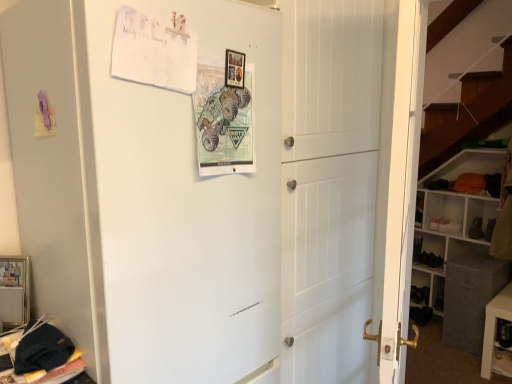
Where is `black fabric cabinet at lower right`? This screenshot has height=384, width=512. black fabric cabinet at lower right is located at coordinates (420, 288).

Measure the distance between white matte refrigerator at upper left and camera.

white matte refrigerator at upper left and camera are 85.77 centimeters apart.

Find the location of a particular element. Image resolution: width=512 pixels, height=384 pixels. black leather shoe at right, which is counted as the second shoe, starting from the right is located at coordinates (417, 248).

Image resolution: width=512 pixels, height=384 pixels. Describe the element at coordinates (417, 248) in the screenshot. I see `black leather shoe at right, which is counted as the second shoe, starting from the right` at that location.

The height and width of the screenshot is (384, 512). Find the location of `white wooden bookshelf at right`. white wooden bookshelf at right is located at coordinates (462, 248).

Considering the relative sizes of black fabric cabinet at lower right and white matte refrigerator at upper left in the image provided, is black fabric cabinet at lower right taller than white matte refrigerator at upper left?

No, black fabric cabinet at lower right is not taller than white matte refrigerator at upper left.

Between black fabric cabinet at lower right and white matte refrigerator at upper left, which one has larger size?

white matte refrigerator at upper left is bigger.

Is white matte refrigerator at upper left a part of black fabric cabinet at lower right?

Definitely not — white matte refrigerator at upper left is not inside black fabric cabinet at lower right.

From a real-world perspective, is black fabric cabinet at lower right beneath white matte refrigerator at upper left?

Yes, from a real-world perspective, black fabric cabinet at lower right is beneath white matte refrigerator at upper left.

Is white wooden bookshelf at right completely or partially inside black leather shoe at lower right, placed as the second shoe when sorted from left to right?

No, white wooden bookshelf at right is located outside of black leather shoe at lower right, placed as the second shoe when sorted from left to right.

Considering the sizes of black leather shoe at lower right, which ranks as the first shoe in right-to-left order, and white wooden bookshelf at right in the image, is black leather shoe at lower right, which ranks as the first shoe in right-to-left order, taller or shorter than white wooden bookshelf at right?

In the image, black leather shoe at lower right, which ranks as the first shoe in right-to-left order, appears to be shorter than white wooden bookshelf at right.

From a real-world perspective, which object stands above the other?

white wooden bookshelf at right, from a real-world perspective.

Is black leather shoe at lower right, placed as the second shoe when sorted from left to right, aimed at white wooden bookshelf at right?

Yes, black leather shoe at lower right, placed as the second shoe when sorted from left to right, is oriented towards white wooden bookshelf at right.

Would you say white wooden bookshelf at right is a long distance from black fabric cabinet at lower right?

That's not correct — white wooden bookshelf at right is a little close to black fabric cabinet at lower right.

Considering the sizes of objects white wooden bookshelf at right and black fabric cabinet at lower right in the image provided, who is smaller, white wooden bookshelf at right or black fabric cabinet at lower right?

With smaller size is black fabric cabinet at lower right.

Relative to black fabric cabinet at lower right, is white wooden bookshelf at right in front or behind?

Clearly, white wooden bookshelf at right is in front of black fabric cabinet at lower right.

From a real-world perspective, is white wooden bookshelf at right located beneath black fabric cabinet at lower right?

No, from a real-world perspective, white wooden bookshelf at right is not below black fabric cabinet at lower right.

Considering the sizes of objects white wooden bookshelf at right and white matte refrigerator at upper left in the image provided, who is shorter, white wooden bookshelf at right or white matte refrigerator at upper left?

white wooden bookshelf at right.

How distant is white wooden bookshelf at right from white matte refrigerator at upper left?

They are 7.39 feet apart.

Is white wooden bookshelf at right far away from white matte refrigerator at upper left?

Absolutely, white wooden bookshelf at right is distant from white matte refrigerator at upper left.

From the image's perspective, does white wooden bookshelf at right appear higher than white matte refrigerator at upper left?

No.

Is point (119, 73) positioned before point (432, 262)?

Yes, point (119, 73) is in front of point (432, 262).

Find the location of `the 2nd shoe below the white paper postcard at upper left, which is the second postcard in right-to-left order (from the image's perspective)`. the 2nd shoe below the white paper postcard at upper left, which is the second postcard in right-to-left order (from the image's perspective) is located at coordinates (430, 260).

From a real-world perspective, is white paper postcard at upper left, which is the second postcard in right-to-left order, physically located above or below black leather shoe at lower right, placed as the second shoe when sorted from left to right?

white paper postcard at upper left, which is the second postcard in right-to-left order, is situated higher than black leather shoe at lower right, placed as the second shoe when sorted from left to right, in the real world.

Based on the photo, considering the relative sizes of white paper postcard at upper left, which appears as the 1th postcard when viewed from the left, and black leather shoe at lower right, which ranks as the first shoe in right-to-left order, in the image provided, is white paper postcard at upper left, which appears as the 1th postcard when viewed from the left, wider than black leather shoe at lower right, which ranks as the first shoe in right-to-left order,?

Incorrect, the width of white paper postcard at upper left, which appears as the 1th postcard when viewed from the left, does not surpass that of black leather shoe at lower right, which ranks as the first shoe in right-to-left order.

How many degrees apart are the facing directions of white paper postcard at upper left, which is the second postcard in right-to-left order, and black fabric cabinet at lower right?

The angle between the facing direction of white paper postcard at upper left, which is the second postcard in right-to-left order, and the facing direction of black fabric cabinet at lower right is 91.5 degrees.

From the image's perspective, is white paper postcard at upper left, which is the second postcard in right-to-left order, located above black fabric cabinet at lower right?

Correct, white paper postcard at upper left, which is the second postcard in right-to-left order, appears higher than black fabric cabinet at lower right in the image.

Which object is wider, white paper postcard at upper left, which appears as the 1th postcard when viewed from the left, or black fabric cabinet at lower right?

black fabric cabinet at lower right.

The height and width of the screenshot is (384, 512). Find the location of `postcard that is the 2nd object located above the black fabric cabinet at lower right (from the image's perspective)`. postcard that is the 2nd object located above the black fabric cabinet at lower right (from the image's perspective) is located at coordinates click(x=154, y=51).

Looking at this image, is black leather shoe at lower right, placed as the second shoe when sorted from left to right, directly adjacent to black fabric cabinet at lower right?

black leather shoe at lower right, placed as the second shoe when sorted from left to right, and black fabric cabinet at lower right are clearly separated.

Could you measure the distance between black leather shoe at lower right, which ranks as the first shoe in right-to-left order, and black fabric cabinet at lower right?

black leather shoe at lower right, which ranks as the first shoe in right-to-left order, is 7.61 inches away from black fabric cabinet at lower right.

Is black fabric cabinet at lower right inside black leather shoe at lower right, placed as the second shoe when sorted from left to right?

No, black fabric cabinet at lower right is not inside black leather shoe at lower right, placed as the second shoe when sorted from left to right.

Between black leather shoe at lower right, which ranks as the first shoe in right-to-left order, and black fabric cabinet at lower right, which one appears on the left side from the viewer's perspective?

Positioned to the left is black fabric cabinet at lower right.

Locate an element on the screen. This screenshot has height=384, width=512. door located above the black fabric cabinet at lower right (from the image's perspective) is located at coordinates (182, 210).

Locate an element on the screen. The image size is (512, 384). bookshelf that is above the black leather shoe at lower right, placed as the second shoe when sorted from left to right (from a real-world perspective) is located at coordinates (462, 248).

Based on their spatial positions, is white wooden bookshelf at right or white paper postcard at upper left, which is the second postcard in right-to-left order, closer to black leather shoe at lower right, which ranks as the first shoe in right-to-left order?

white wooden bookshelf at right lies closer to black leather shoe at lower right, which ranks as the first shoe in right-to-left order, than the other object.

Looking at the image, which one is located closer to black fabric cabinet at lower right, white paper postcard at upper left, which is the second postcard in right-to-left order, or black leather shoe at lower right, which ranks as the first shoe in right-to-left order?

black leather shoe at lower right, which ranks as the first shoe in right-to-left order, lies closer to black fabric cabinet at lower right than the other object.

From the image, which object appears to be nearer to black leather shoe at lower right, placed as the second shoe when sorted from left to right, black leather shoe at right, the 1th shoe from the left, or matte paper postcard at center, placed as the 2th postcard when sorted from left to right?

black leather shoe at right, the 1th shoe from the left, lies closer to black leather shoe at lower right, placed as the second shoe when sorted from left to right, than the other object.

Which object lies further to the anchor point white paper postcard at upper left, which is the second postcard in right-to-left order, white wooden bookshelf at right or black fabric cabinet at lower right?

Based on the image, black fabric cabinet at lower right appears to be further to white paper postcard at upper left, which is the second postcard in right-to-left order.

Which object lies nearer to the anchor point black leather shoe at lower right, which ranks as the first shoe in right-to-left order, matte paper postcard at center, placed as the 2th postcard when sorted from left to right, or black fabric cabinet at lower right?

Based on the image, black fabric cabinet at lower right appears to be nearer to black leather shoe at lower right, which ranks as the first shoe in right-to-left order.

Estimate the real-world distances between objects in this image. Which object is further from black leather shoe at lower right, placed as the second shoe when sorted from left to right, white wooden bookshelf at right or white matte refrigerator at upper left?

Among the two, white matte refrigerator at upper left is located further to black leather shoe at lower right, placed as the second shoe when sorted from left to right.

Estimate the real-world distances between objects in this image. Which object is closer to white paper postcard at upper left, which appears as the 1th postcard when viewed from the left, white matte refrigerator at upper left or white wooden bookshelf at right?

The object closer to white paper postcard at upper left, which appears as the 1th postcard when viewed from the left, is white matte refrigerator at upper left.

Estimate the real-world distances between objects in this image. Which object is further from black leather shoe at right, the 1th shoe from the left, white paper postcard at upper left, which appears as the 1th postcard when viewed from the left, or black leather shoe at lower right, placed as the second shoe when sorted from left to right?

white paper postcard at upper left, which appears as the 1th postcard when viewed from the left, lies further to black leather shoe at right, the 1th shoe from the left, than the other object.

The height and width of the screenshot is (384, 512). I want to click on shoe between matte paper postcard at center, which ranks as the 1th postcard in right-to-left order, and black fabric cabinet at lower right, along the z-axis, so click(x=430, y=260).

The width and height of the screenshot is (512, 384). In order to click on cabinet between matte paper postcard at center, which ranks as the 1th postcard in right-to-left order, and black leather shoe at right, the 1th shoe from the left, in the front-back direction in this screenshot , I will do `click(420, 288)`.

The image size is (512, 384). Find the location of `shoe located between white wooden bookshelf at right and black leather shoe at right, the 1th shoe from the left, in the depth direction`. shoe located between white wooden bookshelf at right and black leather shoe at right, the 1th shoe from the left, in the depth direction is located at coordinates (430, 260).

Where is `bookshelf between white paper postcard at upper left, which is the second postcard in right-to-left order, and black fabric cabinet at lower right in the front-back direction`? bookshelf between white paper postcard at upper left, which is the second postcard in right-to-left order, and black fabric cabinet at lower right in the front-back direction is located at coordinates (462, 248).